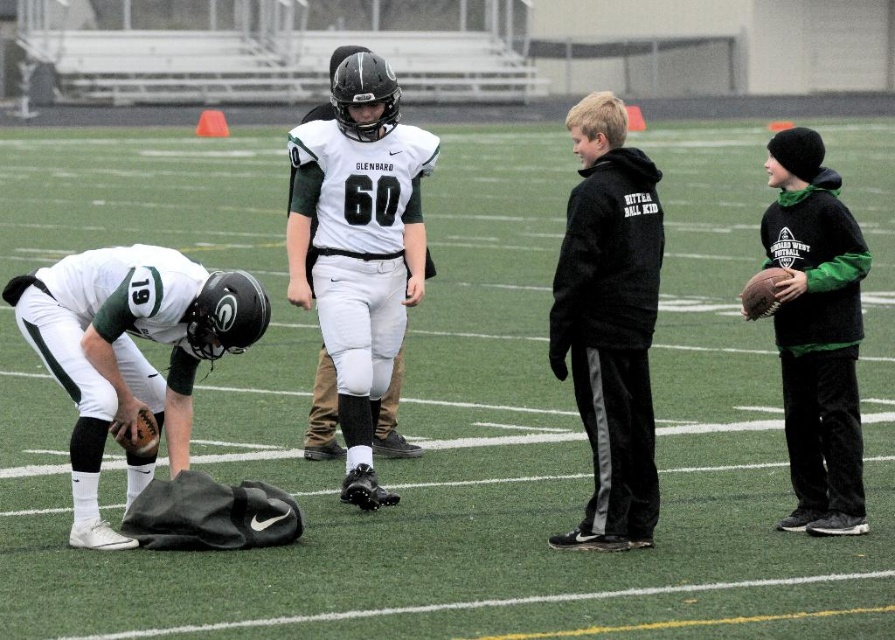
You are a coach observing the football practice. You notice two fleece hoodies on the field. The black fleece hoodie at center and the dark green fleece hoodie at right. Which one is smaller in size?

The black fleece hoodie at center is smaller than the dark green fleece hoodie at right.

You are a photographer standing at the camera position. You want to take a photo of the point at coordinates point (627, 339). The focus range of your camera is set to 20 feet. Will the point be in focus?

The distance of point (627, 339) from the camera is 23.25 feet, which is beyond the camera focus range of 20 feet. Therefore, the point will not be in focus.